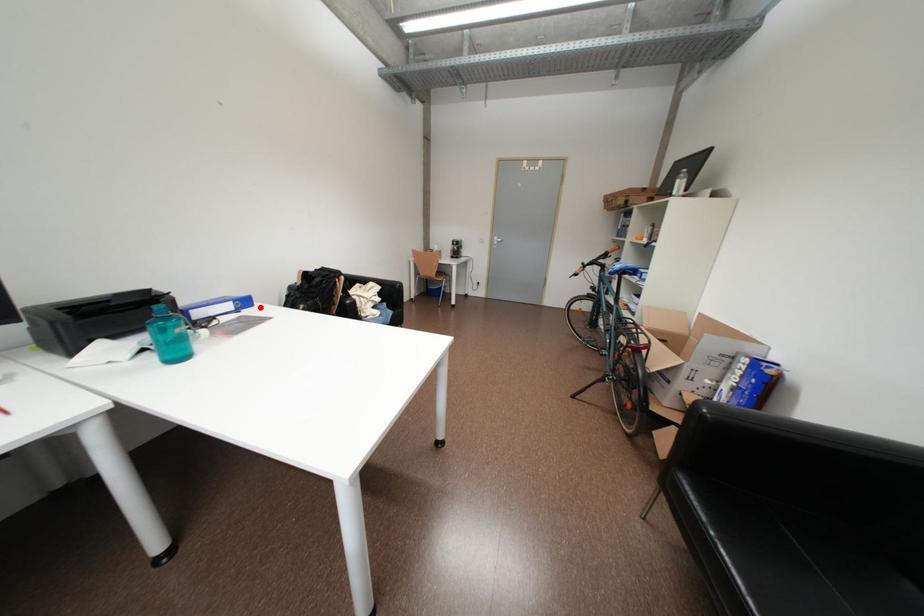
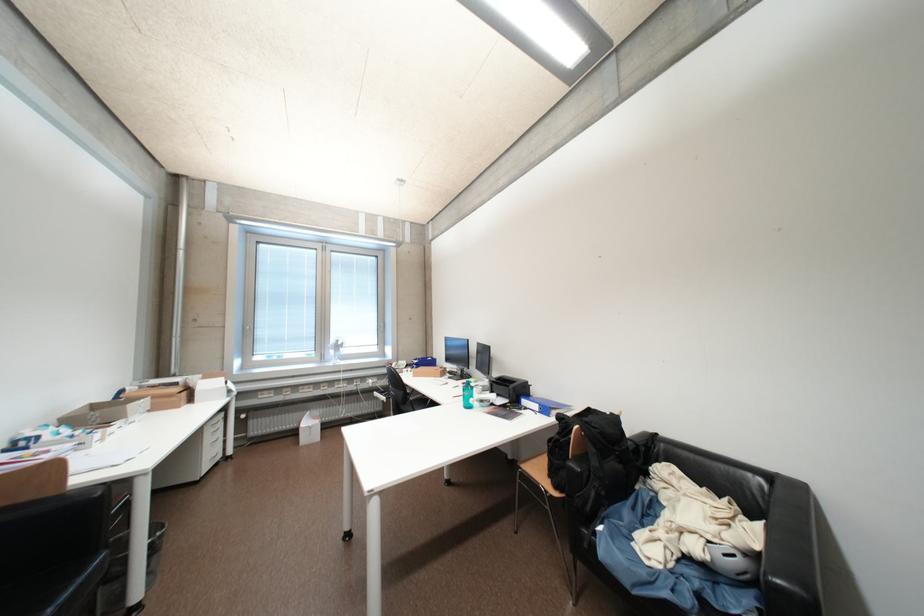
Where in the second image is the point corresponding to the highlighted location from the first image?

(555, 418)